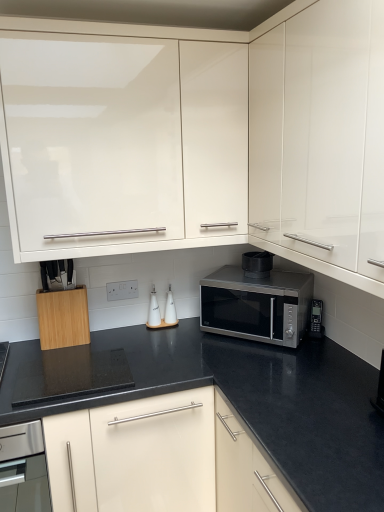
Question: Is white glossy salt shaker at center, the 1th appliance viewed from the left, positioned far away from white ceramic oil bottles at center, the 2th appliance from the left?

Choices:
 (A) no
 (B) yes

Answer: (A)

Question: Would you say white glossy salt shaker at center, arranged as the 4th appliance when viewed from the right, is outside white ceramic oil bottles at center, the 2th appliance from the left?

Choices:
 (A) yes
 (B) no

Answer: (A)

Question: Is white glossy salt shaker at center, the 1th appliance viewed from the left, positioned in front of white ceramic oil bottles at center, the 2th appliance from the left?

Choices:
 (A) no
 (B) yes

Answer: (B)

Question: Does white glossy salt shaker at center, the 1th appliance viewed from the left, lie behind white ceramic oil bottles at center, the 2th appliance from the left?

Choices:
 (A) no
 (B) yes

Answer: (A)

Question: Does white glossy salt shaker at center, the 1th appliance viewed from the left, have a smaller size compared to white ceramic oil bottles at center, the 2th appliance from the left?

Choices:
 (A) yes
 (B) no

Answer: (A)

Question: Can you confirm if white glossy salt shaker at center, the 1th appliance viewed from the left, is taller than white ceramic oil bottles at center, the third appliance positioned from the right?

Choices:
 (A) no
 (B) yes

Answer: (B)

Question: Can you confirm if white ceramic oil bottles at center, the third appliance positioned from the right, is smaller than white glossy salt shaker at center, arranged as the 4th appliance when viewed from the right?

Choices:
 (A) yes
 (B) no

Answer: (B)

Question: Does white ceramic oil bottles at center, the third appliance positioned from the right, turn towards white glossy salt shaker at center, arranged as the 4th appliance when viewed from the right?

Choices:
 (A) yes
 (B) no

Answer: (B)

Question: Considering the relative sizes of white ceramic oil bottles at center, the 2th appliance from the left, and white glossy salt shaker at center, arranged as the 4th appliance when viewed from the right, in the image provided, is white ceramic oil bottles at center, the 2th appliance from the left, bigger than white glossy salt shaker at center, arranged as the 4th appliance when viewed from the right,?

Choices:
 (A) yes
 (B) no

Answer: (A)

Question: From the image's perspective, would you say white ceramic oil bottles at center, the 2th appliance from the left, is positioned over white glossy salt shaker at center, the 1th appliance viewed from the left?

Choices:
 (A) yes
 (B) no

Answer: (A)

Question: Considering the relative positions of white ceramic oil bottles at center, the third appliance positioned from the right, and white glossy salt shaker at center, the 1th appliance viewed from the left, in the image provided, is white ceramic oil bottles at center, the third appliance positioned from the right, to the right of white glossy salt shaker at center, the 1th appliance viewed from the left, from the viewer's perspective?

Choices:
 (A) no
 (B) yes

Answer: (B)

Question: From a real-world perspective, is white ceramic oil bottles at center, the third appliance positioned from the right, below white glossy salt shaker at center, the 1th appliance viewed from the left?

Choices:
 (A) no
 (B) yes

Answer: (B)

Question: From a real-world perspective, is black matte microwave at center, the 3th appliance viewed from the left, positioned under satin silver microwave at center based on gravity?

Choices:
 (A) no
 (B) yes

Answer: (A)